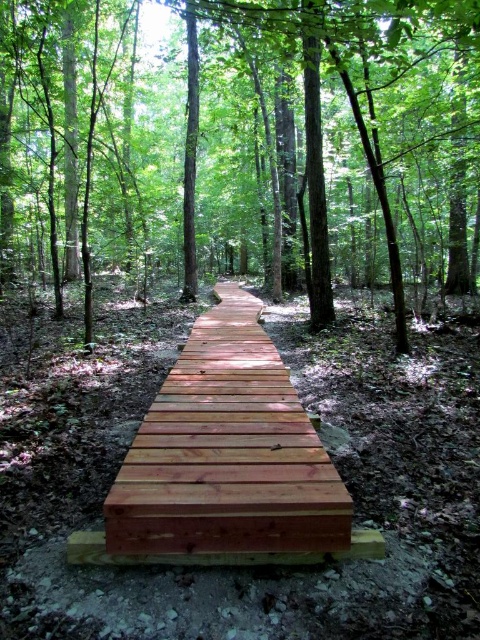
You are standing at the entrance of the forest and see the brown wooden bridge at center. If you want to reach the bridge, which direction should you walk towards?

The brown wooden bridge at center is located at point (240, 145), so you should walk towards the center of the image to reach it.

You are standing on the forest path and see the brown wooden bridge at center and the light brown wooden walkway at center. Which one is located to the right side of the other?

The brown wooden bridge at center is positioned on the right side of the light brown wooden walkway at center.

You are a hiker carrying a 6.3 meters long telescoping pole. You want to cross the brown wooden bridge at center. Can you safely cross the bridge while holding the pole horizontally?

The distance between you and the brown wooden bridge at center is 6.40 meters. Since the pole is 6.3 meters long, which is shorter than the distance to the bridge, you can safely cross the bridge while holding the pole horizontally.